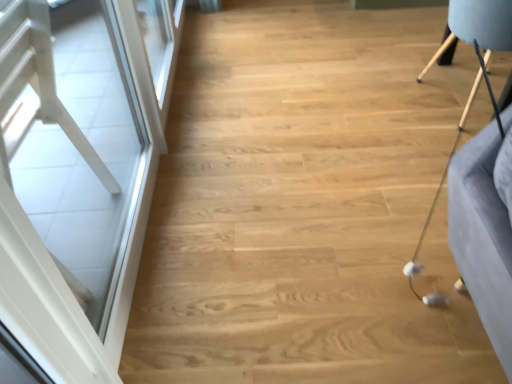
Where is `blank space to the left of light brown wooden chair at upper right`? blank space to the left of light brown wooden chair at upper right is located at coordinates (392, 125).